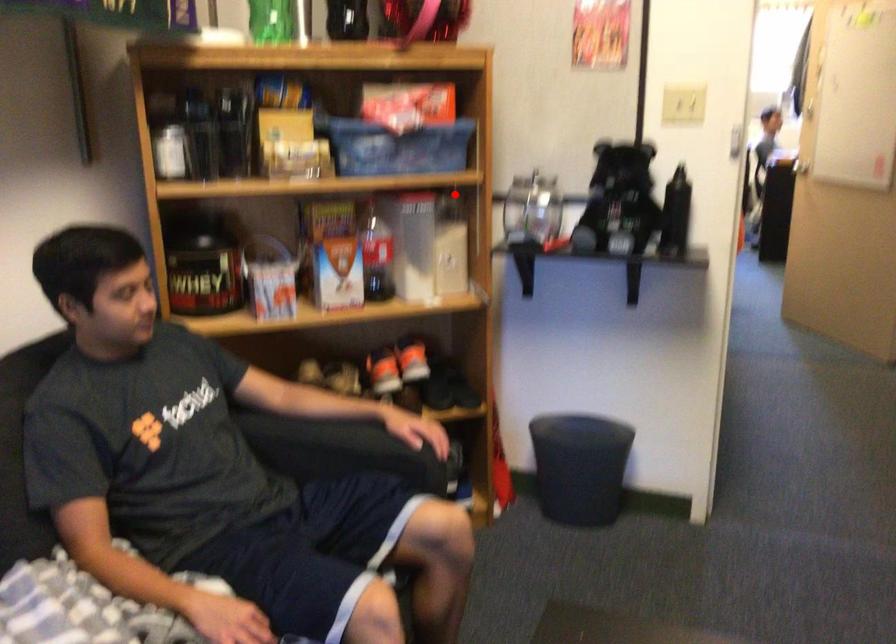
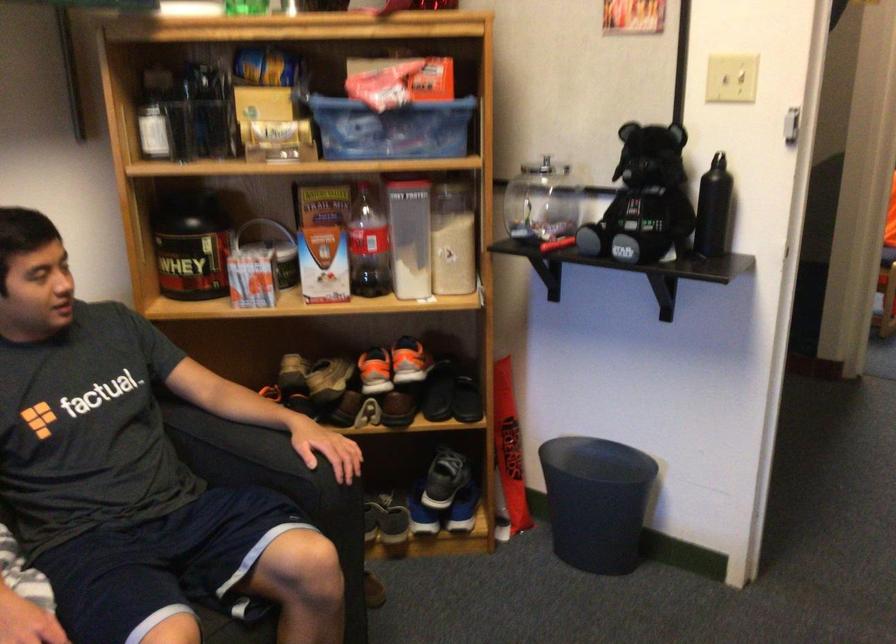
Question: I am providing you with two images of the same scene from different viewpoints. In image1, a red point is highlighted. Considering the same 3D point in image2, which of the following is correct?

Choices:
 (A) It is closer
 (B) It is farther

Answer: (A)